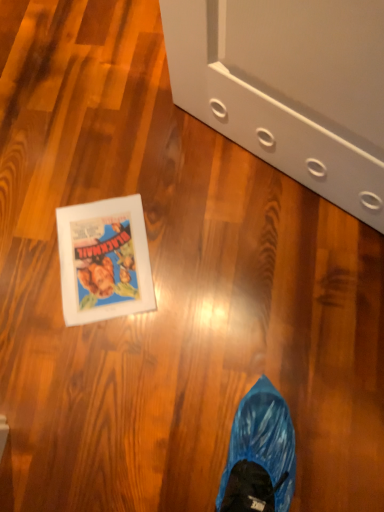
I want to click on free point above matte paper comic book at lower left (from a real-world perspective), so click(104, 259).